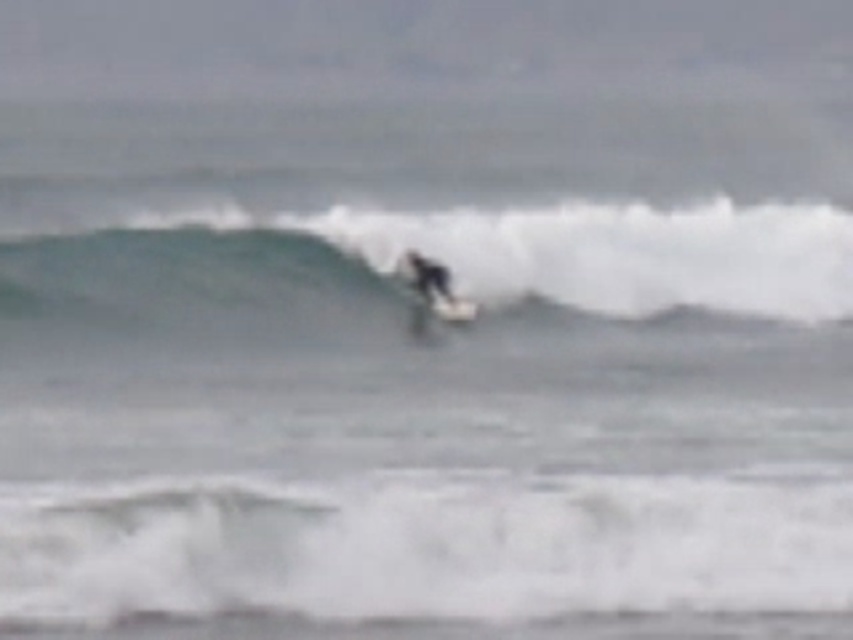
Question: Can you confirm if green rubber surfboard at center is positioned to the left of white matte surfboard at center?

Choices:
 (A) no
 (B) yes

Answer: (B)

Question: Which of the following is the farthest from the observer?

Choices:
 (A) (778, 310)
 (B) (444, 314)

Answer: (A)

Question: Is green rubber surfboard at center bigger than white matte surfboard at center?

Choices:
 (A) yes
 (B) no

Answer: (A)

Question: From the image, what is the correct spatial relationship of green rubber surfboard at center in relation to white matte surfboard at center?

Choices:
 (A) above
 (B) below

Answer: (A)